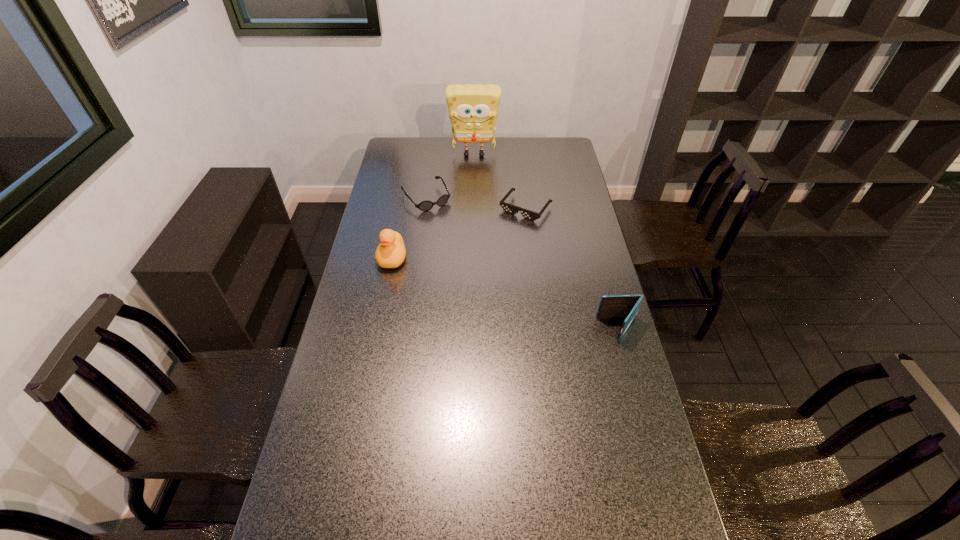
Where is `blank space at the right edge of the desktop`? The height and width of the screenshot is (540, 960). blank space at the right edge of the desktop is located at coordinates (603, 359).

Locate an element on the screen. free space at the far left corner of the desktop is located at coordinates pos(396,153).

Where is `vacant area between the sponge and the second nearest object`? The image size is (960, 540). vacant area between the sponge and the second nearest object is located at coordinates (433, 206).

Image resolution: width=960 pixels, height=540 pixels. Find the location of `vacant area between the wallet and the fourth shortest object`. vacant area between the wallet and the fourth shortest object is located at coordinates [x=506, y=294].

Locate an element on the screen. This screenshot has height=540, width=960. free spot between the nearest object and the right sunglasses is located at coordinates (572, 269).

Locate an element on the screen. Image resolution: width=960 pixels, height=540 pixels. vacant space that is in between the nearest object and the shorter sunglasses is located at coordinates (572, 269).

This screenshot has width=960, height=540. Find the location of `free space between the tallest object and the taller sunglasses`. free space between the tallest object and the taller sunglasses is located at coordinates (450, 176).

You are a GUI agent. You are given a task and a screenshot of the screen. Output one action in this format:
    pyautogui.click(x=<x>, y=<y>)
    Task: Click on the unoccupied area between the wallet and the duck
    Image resolution: width=960 pixels, height=540 pixels.
    Given the screenshot: What is the action you would take?
    pyautogui.click(x=506, y=294)

Find the location of `free space between the fourth tallest object and the farthest object`. free space between the fourth tallest object and the farthest object is located at coordinates (450, 176).

You are a GUI agent. You are given a task and a screenshot of the screen. Output one action in this format:
    pyautogui.click(x=<x>, y=<y>)
    Task: Click on the free space between the duck and the taller sunglasses
    
    Given the screenshot: What is the action you would take?
    pyautogui.click(x=409, y=228)